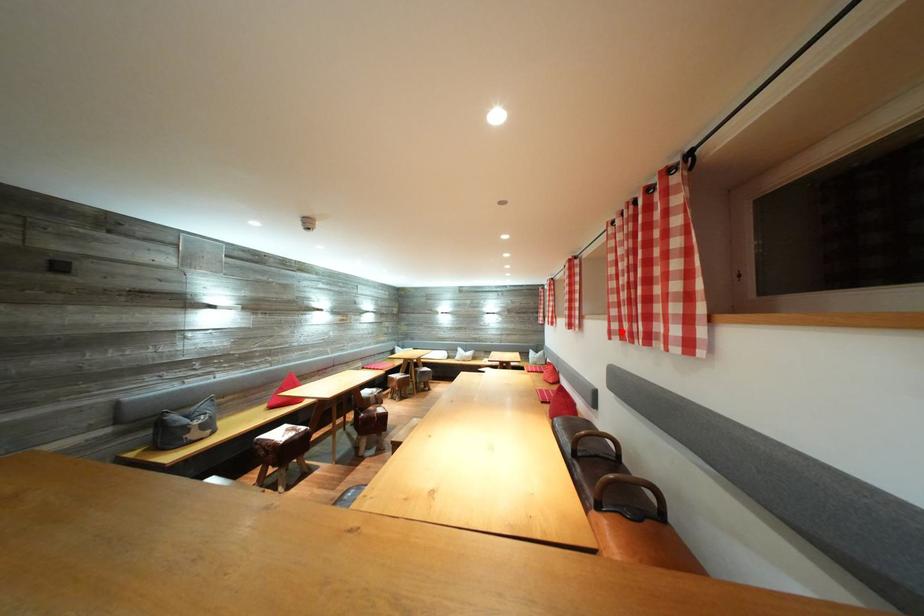
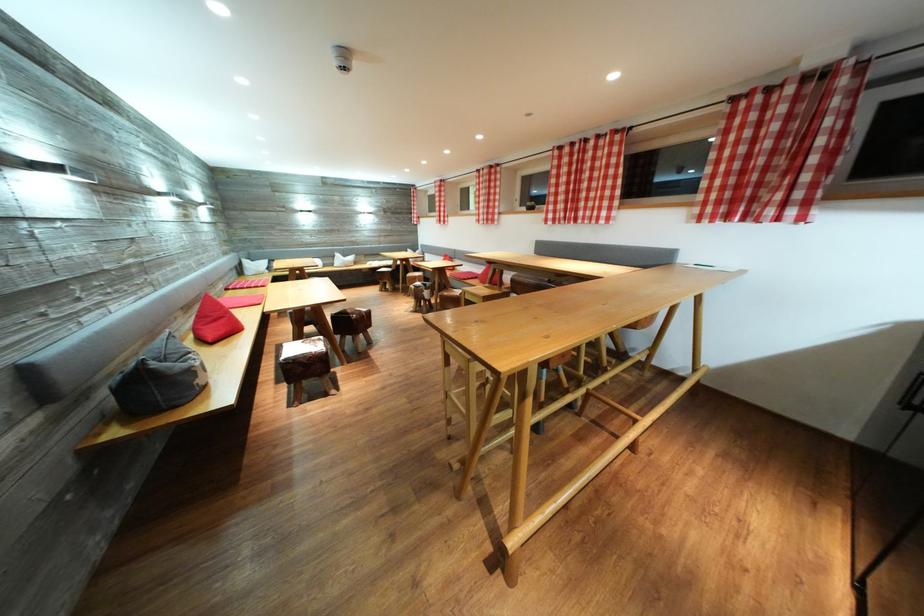
Question: I am providing you with two images of the same scene from different viewpoints. In image1, a red point is highlighted. Considering the same 3D point in image2, which of the following is correct?

Choices:
 (A) It is closer
 (B) It is farther

Answer: (A)